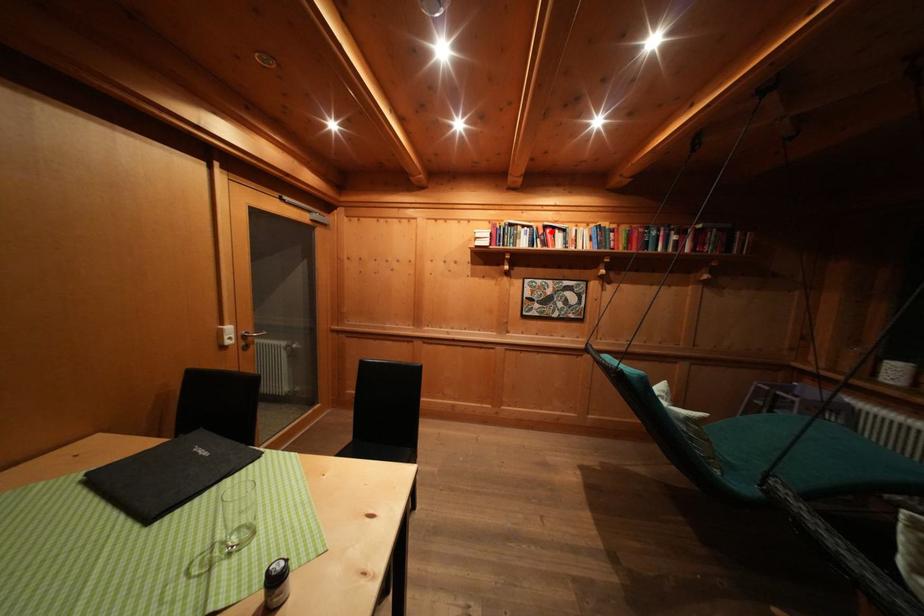
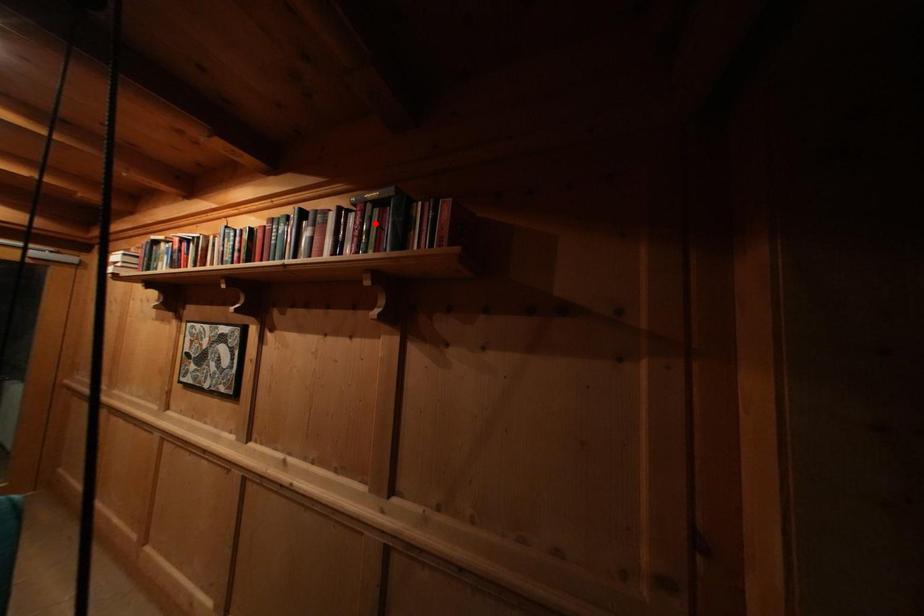
I am providing you with two images of the same scene from different viewpoints. A red point is marked on the first image and another point is marked on the second image. Is the marked point in image1 the same physical position as the marked point in image2?

No